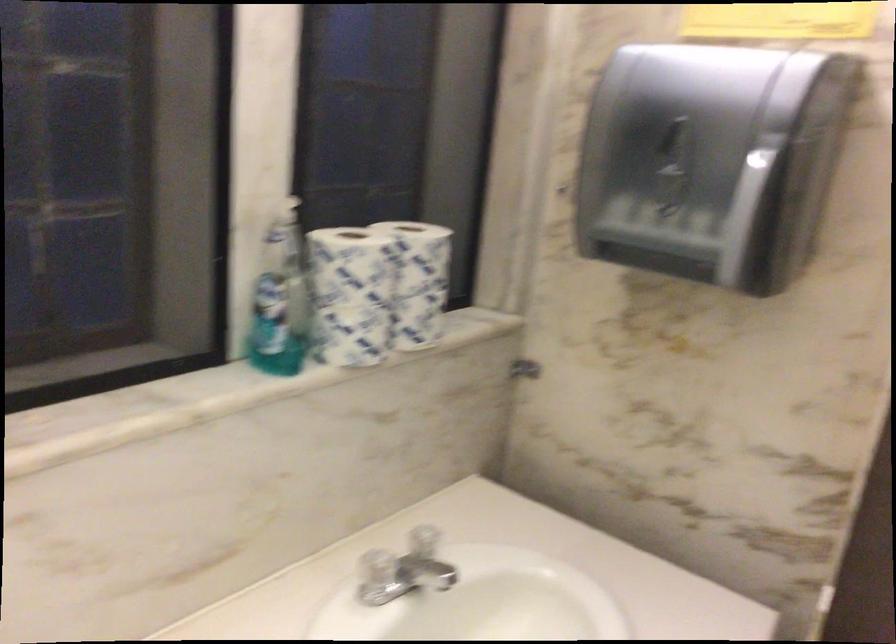
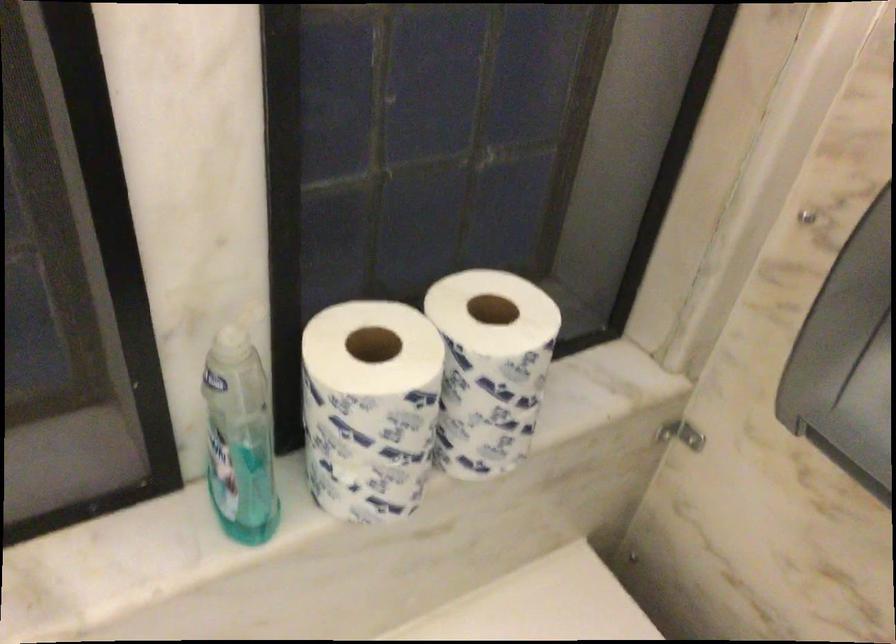
Question: What movement of the cameraman would produce the second image?

Choices:
 (A) Left
 (B) Right
 (C) Forward
 (D) Backward

Answer: (C)